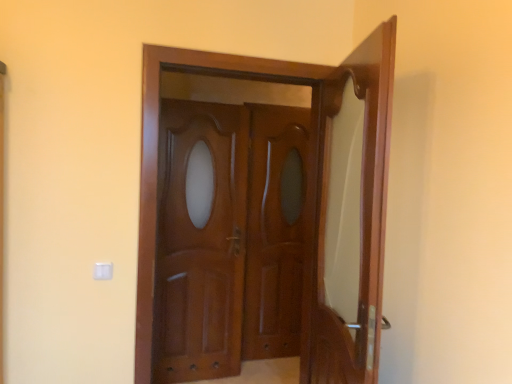
Question: Is the depth of mahogany wood door at center greater than that of glossy wood door at center?

Choices:
 (A) no
 (B) yes

Answer: (A)

Question: Does mahogany wood door at center have a lesser height compared to glossy wood door at center?

Choices:
 (A) yes
 (B) no

Answer: (A)

Question: Does mahogany wood door at center appear on the right side of glossy wood door at center?

Choices:
 (A) yes
 (B) no

Answer: (B)

Question: Would you say mahogany wood door at center is outside glossy wood door at center?

Choices:
 (A) yes
 (B) no

Answer: (A)

Question: From a real-world perspective, does mahogany wood door at center stand above glossy wood door at center?

Choices:
 (A) yes
 (B) no

Answer: (B)

Question: Can glossy wood door at center be found inside mahogany wood door at center?

Choices:
 (A) yes
 (B) no

Answer: (B)

Question: Is glossy wood door at center, which is the 2th door in right-to-left order, to the right of glossy wood door at center from the viewer's perspective?

Choices:
 (A) yes
 (B) no

Answer: (B)

Question: Considering the relative sizes of glossy wood door at center, which is the 2th door in right-to-left order, and glossy wood door at center in the image provided, is glossy wood door at center, which is the 2th door in right-to-left order, wider than glossy wood door at center?

Choices:
 (A) no
 (B) yes

Answer: (B)

Question: Is glossy wood door at center surrounded by glossy wood door at center, positioned as the first door in left-to-right order?

Choices:
 (A) no
 (B) yes

Answer: (A)

Question: Can you confirm if glossy wood door at center, positioned as the first door in left-to-right order, is smaller than glossy wood door at center?

Choices:
 (A) no
 (B) yes

Answer: (A)

Question: Could you tell me if glossy wood door at center, positioned as the first door in left-to-right order, is facing glossy wood door at center?

Choices:
 (A) no
 (B) yes

Answer: (A)

Question: Is glossy wood door at center, positioned as the first door in left-to-right order, closer to camera compared to glossy wood door at center?

Choices:
 (A) no
 (B) yes

Answer: (B)

Question: Could you tell me if mahogany wood door at right, positioned as the 2th door in left-to-right order, is turned towards glossy wood door at center, which is the 2th door in right-to-left order?

Choices:
 (A) no
 (B) yes

Answer: (B)